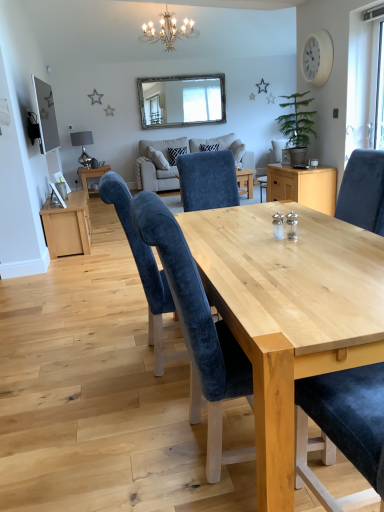
Question: Is silver metallic chandelier at upper center inside or outside of transparent glass window at upper right?

Choices:
 (A) inside
 (B) outside

Answer: (B)

Question: Relative to transparent glass window at upper right, is silver metallic chandelier at upper center in front or behind?

Choices:
 (A) front
 (B) behind

Answer: (B)

Question: Based on their relative distances, which object is farther from the beige fabric couch at center?

Choices:
 (A) transparent glass window at upper right
 (B) silver metallic chandelier at upper center
 (C) velvet blue chair at center, the 2th chair viewed from the back
 (D) satin silver lamp at left
 (E) green matte plant at right

Answer: (C)

Question: Considering the real-world distances, which object is farthest from the transparent glass window at upper right?

Choices:
 (A) silver metallic chandelier at upper center
 (B) velvet blue chair at center, which ranks as the 1th chair in front-to-back order
 (C) green matte plant at right
 (D) satin silver lamp at left
 (E) wooden-framed mirror at upper center

Answer: (D)